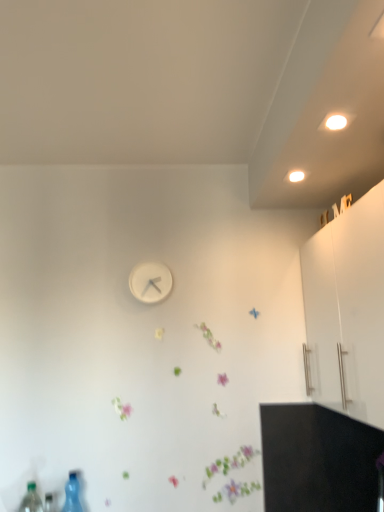
Question: Is purple matte flower at center closer to camera compared to white matte clock at center?

Choices:
 (A) no
 (B) yes

Answer: (B)

Question: Does purple matte flower at center have a greater width compared to white matte clock at center?

Choices:
 (A) no
 (B) yes

Answer: (A)

Question: Would you say purple matte flower at center contains white matte clock at center?

Choices:
 (A) no
 (B) yes

Answer: (A)

Question: Does purple matte flower at center have a smaller size compared to white matte clock at center?

Choices:
 (A) no
 (B) yes

Answer: (B)

Question: Does purple matte flower at center appear on the right side of white matte clock at center?

Choices:
 (A) no
 (B) yes

Answer: (B)

Question: Is transparent plastic bottle at lower left, the second bottle viewed from the front, taller or shorter than white matte cabinet at upper right?

Choices:
 (A) short
 (B) tall

Answer: (A)

Question: From the image's perspective, is transparent plastic bottle at lower left, the 2th bottle viewed from the left, located above or below white matte cabinet at upper right?

Choices:
 (A) above
 (B) below

Answer: (B)

Question: Is transparent plastic bottle at lower left, the second bottle viewed from the front, wider or thinner than white matte cabinet at upper right?

Choices:
 (A) wide
 (B) thin

Answer: (B)

Question: From a real-world perspective, is transparent plastic bottle at lower left, which appears as the first bottle when viewed from the right, positioned above or below white matte cabinet at upper right?

Choices:
 (A) above
 (B) below

Answer: (B)

Question: Based on their positions, is transparent plastic bottle at lower left, the second bottle viewed from the front, located to the left or right of purple matte flower at center?

Choices:
 (A) left
 (B) right

Answer: (A)

Question: In terms of height, does transparent plastic bottle at lower left, which appears as the first bottle when viewed from the right, look taller or shorter compared to purple matte flower at center?

Choices:
 (A) short
 (B) tall

Answer: (B)

Question: In the image, is transparent plastic bottle at lower left, the second bottle viewed from the front, positioned in front of or behind purple matte flower at center?

Choices:
 (A) front
 (B) behind

Answer: (A)

Question: From the image's perspective, relative to purple matte flower at center, is transparent plastic bottle at lower left, the 2th bottle viewed from the left, above or below?

Choices:
 (A) above
 (B) below

Answer: (B)

Question: Relative to transparent plastic bottle at lower left, the 2th bottle viewed from the left, is white matte cabinet at upper right in front or behind?

Choices:
 (A) behind
 (B) front

Answer: (B)

Question: Would you say white matte cabinet at upper right is inside or outside transparent plastic bottle at lower left, the second bottle viewed from the front?

Choices:
 (A) outside
 (B) inside

Answer: (A)